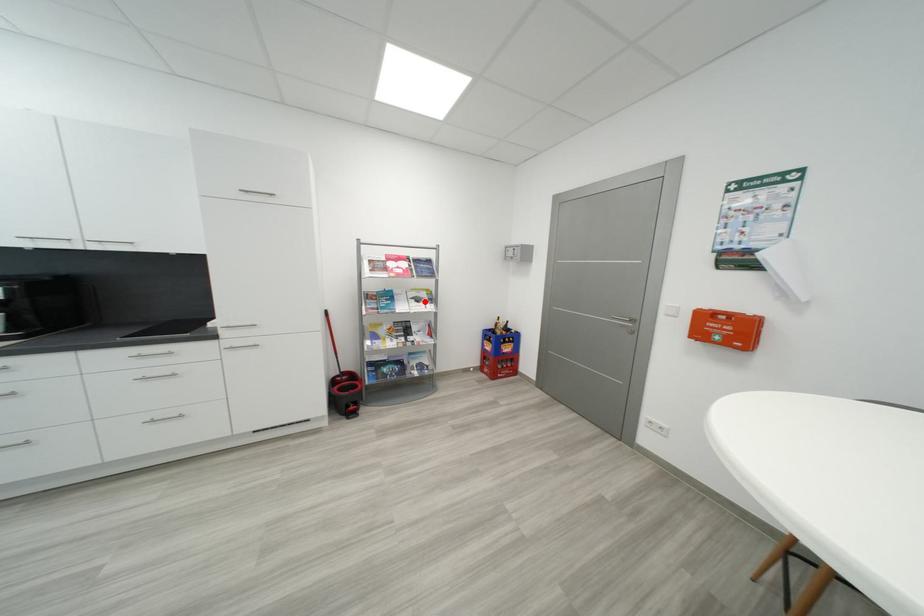
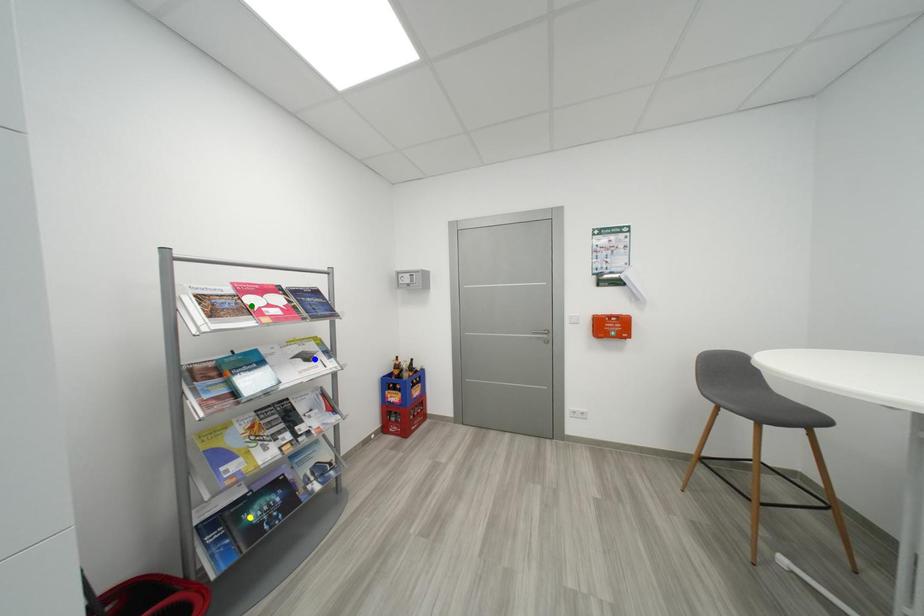
Question: I am providing you with two images of the same scene from different viewpoints. A red point is marked on the first image. You are given multiple points on the second image. Which mark in image 2 goes with the point in image 1?

Choices:
 (A) green point
 (B) yellow point
 (C) blue point

Answer: (C)